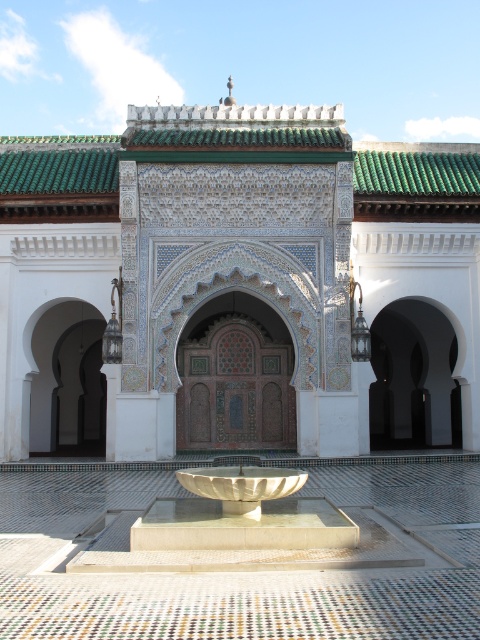
Is white marble fountain at center thinner than white stone bowl at center?

No.

Does white marble fountain at center lie behind white stone bowl at center?

No, white marble fountain at center is closer to the viewer.

The image size is (480, 640). In order to click on white marble fountain at center in this screenshot , I will do `click(242, 513)`.

Can you confirm if white mosaic tile palace at center is wider than white stone bowl at center?

Correct, the width of white mosaic tile palace at center exceeds that of white stone bowl at center.

Where is `white mosaic tile palace at center`? The height and width of the screenshot is (640, 480). white mosaic tile palace at center is located at coordinates (237, 285).

Where is `white mosaic tile palace at center`? The image size is (480, 640). white mosaic tile palace at center is located at coordinates (237, 285).

Is white mosaic tile palace at center bigger than white marble fountain at center?

Yes, white mosaic tile palace at center is bigger than white marble fountain at center.

Consider the image. Is white mosaic tile palace at center wider than white marble fountain at center?

Indeed, white mosaic tile palace at center has a greater width compared to white marble fountain at center.

Where is `white mosaic tile palace at center`? white mosaic tile palace at center is located at coordinates (237, 285).

Image resolution: width=480 pixels, height=640 pixels. I want to click on white mosaic tile palace at center, so click(x=237, y=285).